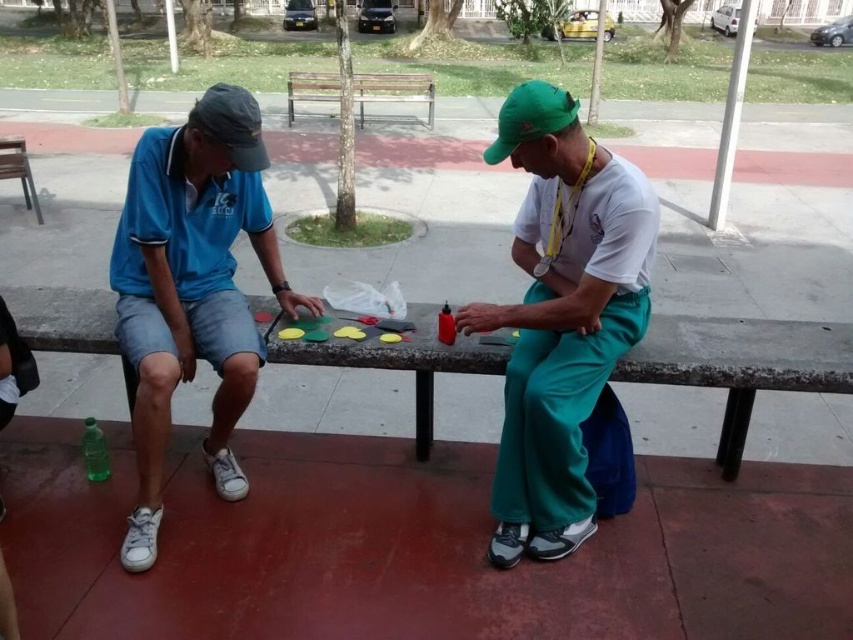
Who is shorter, concrete bench at center or matte black baseball cap at left?

matte black baseball cap at left

Between concrete bench at center and matte black baseball cap at left, which one is positioned higher?

Positioned higher is matte black baseball cap at left.

Locate an element on the screen. The image size is (853, 640). concrete bench at center is located at coordinates (740, 364).

Consider the image. Does wooden bench at center appear on the left side of wooden bench at left?

In fact, wooden bench at center is to the right of wooden bench at left.

Who is lower down, wooden bench at center or wooden bench at left?

wooden bench at left

Is point (424, 93) positioned after point (28, 180)?

Yes, it is.

At what (x,y) coordinates should I click in order to perform the action: click on wooden bench at center. Please return your answer as a coordinate pair (x, y). The height and width of the screenshot is (640, 853). Looking at the image, I should click on (393, 90).

Is white matte shirt at center bigger than blue cotton shirt at left?

No, white matte shirt at center is not bigger than blue cotton shirt at left.

Is the position of white matte shirt at center less distant than that of blue cotton shirt at left?

That is True.

Which is behind, point (477, 324) or point (224, 193)?

Positioned behind is point (224, 193).

Where is `white matte shirt at center`? The height and width of the screenshot is (640, 853). white matte shirt at center is located at coordinates (561, 316).